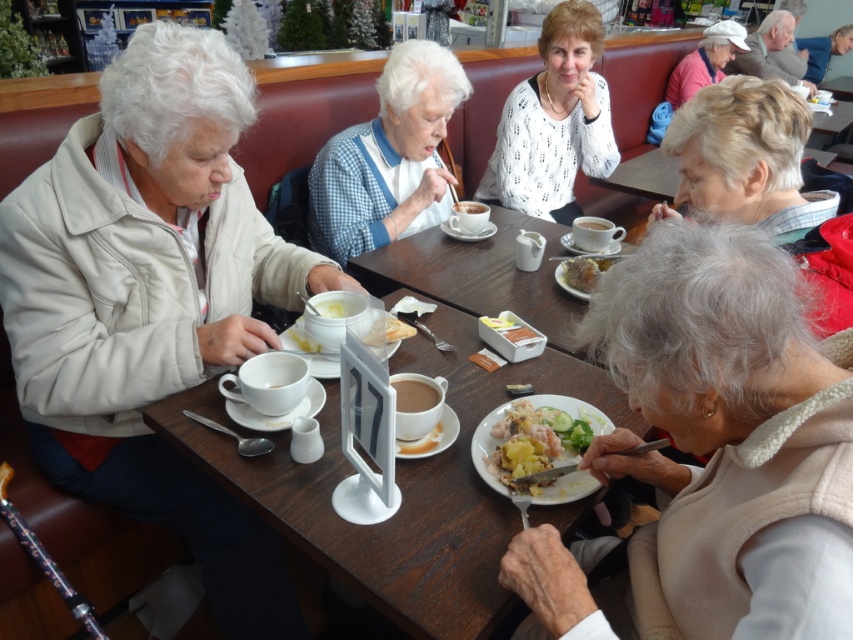
Between white glossy table at center and white ceramic table at center, which one has more height?

white glossy table at center

Locate an element on the screen. white glossy table at center is located at coordinates (399, 486).

At what (x,y) coordinates should I click in order to perform the action: click on white glossy table at center. Please return your answer as a coordinate pair (x, y). This screenshot has height=640, width=853. Looking at the image, I should click on (399, 486).

Can you confirm if white woolen vest at lower right is positioned below shiny plastic fork at lower center?

Indeed, white woolen vest at lower right is positioned under shiny plastic fork at lower center.

Where is `white woolen vest at lower right`? The height and width of the screenshot is (640, 853). white woolen vest at lower right is located at coordinates (712, 451).

Between point (360, 170) and point (357, 264), which one is positioned in front?

Point (357, 264)

Is white checkered shirt at center shorter than white ceramic table at center?

No, white checkered shirt at center is not shorter than white ceramic table at center.

Locate an element on the screen. white checkered shirt at center is located at coordinates (387, 157).